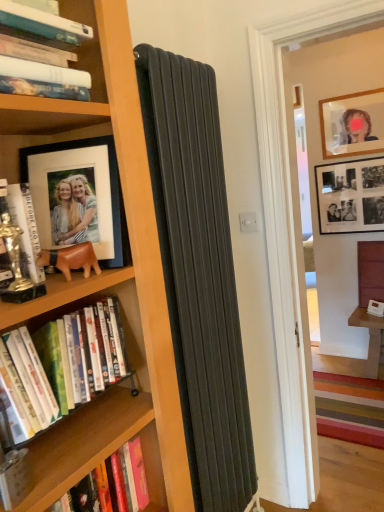
What is the approximate width of matte black radiator at center?

matte black radiator at center is 3.92 inches wide.

Where is `hardcover books at left, placed as the 3th book when sorted from top to bottom`? This screenshot has height=512, width=384. hardcover books at left, placed as the 3th book when sorted from top to bottom is located at coordinates (64, 365).

The image size is (384, 512). Identify the location of hardcover book at upper left, the 4th book positioned from the bottom. (41, 53).

Find the location of a particular element. Image resolution: width=384 pixels, height=512 pixels. black matte picture frame at left, which is the first picture frame in bottom-to-top order is located at coordinates (78, 196).

Locate an element on the screen. This screenshot has width=384, height=512. leather-like brown bear at left is located at coordinates [x=71, y=259].

From the image's perspective, which is below, matte black radiator at center or black matte picture frame at left, positioned as the third picture frame in back-to-front order?

matte black radiator at center, from the image's perspective.

Looking at their sizes, would you say matte black radiator at center is wider or thinner than black matte picture frame at left, which ranks as the 3th picture frame in top-to-bottom order?

matte black radiator at center is thinner than black matte picture frame at left, which ranks as the 3th picture frame in top-to-bottom order.

Is matte black radiator at center not within black matte picture frame at left, placed as the first picture frame when sorted from left to right?

Yes, matte black radiator at center is located beyond the bounds of black matte picture frame at left, placed as the first picture frame when sorted from left to right.

Is hardcover books at left, placed as the 3th book when sorted from top to bottom, at the back of hardcover book at lower left, which is the first book in bottom-to-top order?

No, hardcover books at left, placed as the 3th book when sorted from top to bottom, is not at the back of hardcover book at lower left, which is the first book in bottom-to-top order.

Does hardcover book at lower left, the 4th book in the top-to-bottom sequence, appear on the right side of hardcover books at left, placed as the 3th book when sorted from top to bottom?

Incorrect, hardcover book at lower left, the 4th book in the top-to-bottom sequence, is not on the right side of hardcover books at left, placed as the 3th book when sorted from top to bottom.

From the image's perspective, which one is positioned lower, hardcover book at lower left, the 4th book in the top-to-bottom sequence, or hardcover books at left, the second book from the bottom?

hardcover book at lower left, the 4th book in the top-to-bottom sequence, from the image's perspective.

From the image's perspective, between leather-like brown bear at left and black matte picture frame at left, which ranks as the 3th picture frame in top-to-bottom order, which one is located above?

From the image's view, black matte picture frame at left, which ranks as the 3th picture frame in top-to-bottom order, is above.

What's the angular difference between leather-like brown bear at left and black matte picture frame at left, positioned as the third picture frame in back-to-front order,'s facing directions?

There is a 44.9-degree angle between the facing directions of leather-like brown bear at left and black matte picture frame at left, positioned as the third picture frame in back-to-front order.

Is leather-like brown bear at left behind black matte picture frame at left, the third picture frame viewed from the right?

No, it is not.

Between point (90, 263) and point (45, 240), which one is positioned behind?

The point (45, 240) is more distant.

Considering the sizes of hardcover book at upper left, which is the first book in top-to-bottom order, and black matte photo frame at upper right, which is the third picture frame from front to back, in the image, is hardcover book at upper left, which is the first book in top-to-bottom order, wider or thinner than black matte photo frame at upper right, which is the third picture frame from front to back,?

hardcover book at upper left, which is the first book in top-to-bottom order, is wider than black matte photo frame at upper right, which is the third picture frame from front to back.

Considering the sizes of objects hardcover book at upper left, which is the first book in top-to-bottom order, and black matte photo frame at upper right, the first picture frame viewed from the right, in the image provided, who is smaller, hardcover book at upper left, which is the first book in top-to-bottom order, or black matte photo frame at upper right, the first picture frame viewed from the right,?

Smaller between the two is hardcover book at upper left, which is the first book in top-to-bottom order.

Can you confirm if hardcover book at upper left, which is the first book in top-to-bottom order, is shorter than black matte photo frame at upper right, marked as the 1th picture frame in a back-to-front arrangement?

Correct, hardcover book at upper left, which is the first book in top-to-bottom order, is not as tall as black matte photo frame at upper right, marked as the 1th picture frame in a back-to-front arrangement.

Considering the relative positions of hardcover book at upper left, the 4th book positioned from the bottom, and black matte photo frame at upper right, the second picture frame viewed from the top, in the image provided, is hardcover book at upper left, the 4th book positioned from the bottom, in front of black matte photo frame at upper right, the second picture frame viewed from the top,?

Yes, hardcover book at upper left, the 4th book positioned from the bottom, is closer to the viewer.

Would you say black matte picture frame at left, placed as the first picture frame when sorted from left to right, is to the left or to the right of matte glass picture frame at upper right, marked as the 3th picture frame in a bottom-to-top arrangement, in the picture?

black matte picture frame at left, placed as the first picture frame when sorted from left to right, is to the left of matte glass picture frame at upper right, marked as the 3th picture frame in a bottom-to-top arrangement.

Would you say black matte picture frame at left, positioned as the third picture frame in back-to-front order, is a long distance from matte glass picture frame at upper right, the 2th picture frame positioned from the right?

That's right, there is a large distance between black matte picture frame at left, positioned as the third picture frame in back-to-front order, and matte glass picture frame at upper right, the 2th picture frame positioned from the right.

Is black matte picture frame at left, arranged as the 1th picture frame when viewed from the front, smaller than matte glass picture frame at upper right, the 2th picture frame positioned from the right?

No, black matte picture frame at left, arranged as the 1th picture frame when viewed from the front, is not smaller than matte glass picture frame at upper right, the 2th picture frame positioned from the right.

From the image's perspective, which one is positioned higher, black matte picture frame at left, arranged as the 1th picture frame when viewed from the front, or matte glass picture frame at upper right, arranged as the 2th picture frame when viewed from the front?

matte glass picture frame at upper right, arranged as the 2th picture frame when viewed from the front.

Considering the relative sizes of hardcover book at upper left, the 4th book positioned from the bottom, and hardcover book at left, the third book in the bottom-to-top sequence, in the image provided, is hardcover book at upper left, the 4th book positioned from the bottom, bigger than hardcover book at left, the third book in the bottom-to-top sequence,?

Yes, hardcover book at upper left, the 4th book positioned from the bottom, is bigger than hardcover book at left, the third book in the bottom-to-top sequence.

Can you confirm if hardcover book at upper left, which is the first book in top-to-bottom order, is positioned to the left of hardcover book at left, the third book in the bottom-to-top sequence?

Incorrect, hardcover book at upper left, which is the first book in top-to-bottom order, is not on the left side of hardcover book at left, the third book in the bottom-to-top sequence.

Is hardcover book at upper left, which is the first book in top-to-bottom order, positioned with its back to hardcover book at left, the third book in the bottom-to-top sequence?

No, hardcover book at upper left, which is the first book in top-to-bottom order, is not facing the opposite direction of hardcover book at left, the third book in the bottom-to-top sequence.

How different are the orientations of hardcover book at upper left, which is the first book in top-to-bottom order, and hardcover book at left, which appears as the 2th book when viewed from the top, in degrees?

The angle between the facing direction of hardcover book at upper left, which is the first book in top-to-bottom order, and the facing direction of hardcover book at left, which appears as the 2th book when viewed from the top, is 1.8 degrees.

From a real-world perspective, between hardcover book at left, which appears as the 2th book when viewed from the top, and black matte picture frame at left, positioned as the third picture frame in back-to-front order, who is vertically lower?

hardcover book at left, which appears as the 2th book when viewed from the top, is physically lower.

Find the location of `the 1st picture frame to the right of the hardcover book at left, which appears as the 2th book when viewed from the top, counting from the anchor's position`. the 1st picture frame to the right of the hardcover book at left, which appears as the 2th book when viewed from the top, counting from the anchor's position is located at coordinates (78, 196).

Would you say black matte picture frame at left, which ranks as the 3th picture frame in top-to-bottom order, is part of hardcover book at left, the third book in the bottom-to-top sequence,'s contents?

No, black matte picture frame at left, which ranks as the 3th picture frame in top-to-bottom order, is not inside hardcover book at left, the third book in the bottom-to-top sequence.

Does hardcover book at left, the third book in the bottom-to-top sequence, come behind black matte picture frame at left, placed as the first picture frame when sorted from left to right?

No, hardcover book at left, the third book in the bottom-to-top sequence, is closer to the camera.

Where is `curtain behind the black matte picture frame at left, positioned as the third picture frame in back-to-front order`? This screenshot has height=512, width=384. curtain behind the black matte picture frame at left, positioned as the third picture frame in back-to-front order is located at coordinates (198, 274).

From the image's perspective, starting from the hardcover book at lower left, the 4th book in the top-to-bottom sequence, which book is the 1st one above? Please provide its 2D coordinates.

[(64, 365)]

Based on their spatial positions, is hardcover book at left, the third book in the bottom-to-top sequence, or hardcover books at left, the second book from the bottom, closer to matte black radiator at center?

Based on the image, hardcover books at left, the second book from the bottom, appears to be nearer to matte black radiator at center.

Considering their positions, is matte glass picture frame at upper right, marked as the 3th picture frame in a bottom-to-top arrangement, positioned further to hardcover book at upper left, the 4th book positioned from the bottom, than leather-like brown bear at left?

matte glass picture frame at upper right, marked as the 3th picture frame in a bottom-to-top arrangement, is further to hardcover book at upper left, the 4th book positioned from the bottom.

Estimate the real-world distances between objects in this image. Which object is closer to hardcover book at left, the third book in the bottom-to-top sequence, leather-like brown bear at left or black matte picture frame at left, placed as the first picture frame when sorted from left to right?

leather-like brown bear at left is positioned closer to the anchor hardcover book at left, the third book in the bottom-to-top sequence.

Which object lies nearer to the anchor point matte black radiator at center, hardcover book at upper left, which is the first book in top-to-bottom order, or hardcover book at lower left, the 4th book in the top-to-bottom sequence?

The object closer to matte black radiator at center is hardcover book at lower left, the 4th book in the top-to-bottom sequence.

Considering their positions, is matte glass picture frame at upper right, which appears as the second picture frame when viewed from the back, positioned further to black matte photo frame at upper right, marked as the 1th picture frame in a back-to-front arrangement, than hardcover book at lower left, which is the first book in bottom-to-top order?

hardcover book at lower left, which is the first book in bottom-to-top order, is positioned further to the anchor black matte photo frame at upper right, marked as the 1th picture frame in a back-to-front arrangement.

When comparing their distances from hardcover book at lower left, the 4th book in the top-to-bottom sequence, does leather-like brown bear at left or black matte picture frame at left, which ranks as the 3th picture frame in top-to-bottom order, seem closer?

Among the two, leather-like brown bear at left is located nearer to hardcover book at lower left, the 4th book in the top-to-bottom sequence.

Looking at the image, which one is located further to matte black radiator at center, black matte photo frame at upper right, acting as the 2th picture frame starting from the bottom, or leather-like brown bear at left?

Among the two, black matte photo frame at upper right, acting as the 2th picture frame starting from the bottom, is located further to matte black radiator at center.

Based on the photo, estimate the real-world distances between objects in this image. Which object is further from matte black radiator at center, black matte picture frame at left, which is the first picture frame in bottom-to-top order, or hardcover book at lower left, the 4th book in the top-to-bottom sequence?

Based on the image, hardcover book at lower left, the 4th book in the top-to-bottom sequence, appears to be further to matte black radiator at center.

This screenshot has height=512, width=384. I want to click on book that lies between black matte picture frame at left, positioned as the third picture frame in back-to-front order, and hardcover books at left, the second book from the bottom, from top to bottom, so click(26, 227).

This screenshot has width=384, height=512. In order to click on curtain positioned between hardcover book at lower left, which is the first book in bottom-to-top order, and matte glass picture frame at upper right, which appears as the second picture frame when viewed from the back, from near to far in this screenshot , I will do `click(198, 274)`.

Locate an element on the screen. Image resolution: width=384 pixels, height=512 pixels. book between black matte picture frame at left, placed as the first picture frame when sorted from left to right, and leather-like brown bear at left, in the vertical direction is located at coordinates (26, 227).

Find the location of a particular element. The width and height of the screenshot is (384, 512). book between hardcover book at upper left, the 4th book positioned from the bottom, and hardcover books at left, placed as the 3th book when sorted from top to bottom, in the vertical direction is located at coordinates (26, 227).